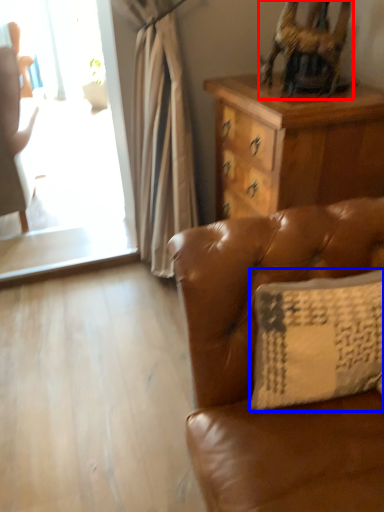
Question: Which object appears farthest to the camera in this image, swivel chair (highlighted by a red box) or pillow (highlighted by a blue box)?

Choices:
 (A) swivel chair
 (B) pillow

Answer: (A)